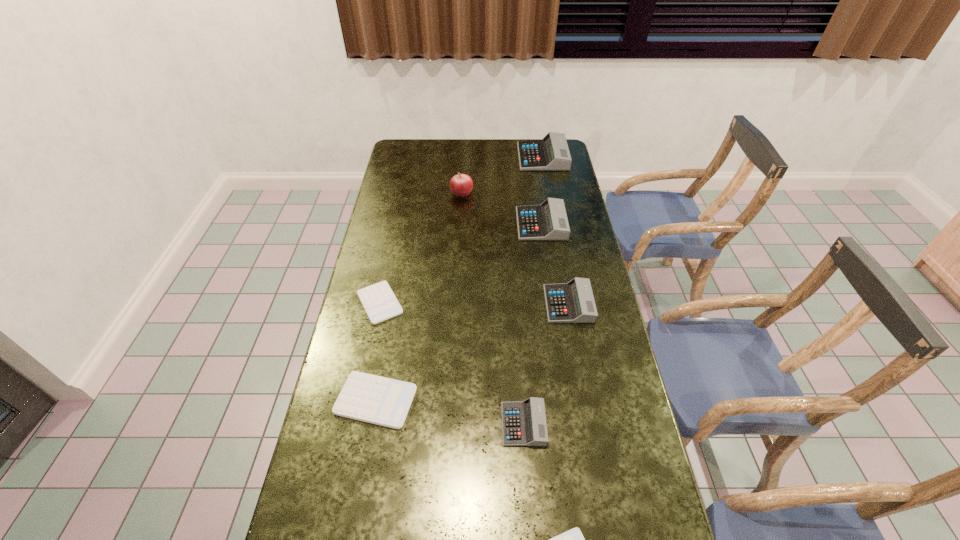
Find the location of `the second farthest white calculator`. the second farthest white calculator is located at coordinates (365, 397).

Where is `the third shortest object`? the third shortest object is located at coordinates (365, 397).

In order to click on the sixth tallest calculator in this screenshot , I will do pyautogui.click(x=378, y=300).

The height and width of the screenshot is (540, 960). What are the coordinates of `the second shortest object` in the screenshot? It's located at (378, 300).

Locate an element on the screen. The width and height of the screenshot is (960, 540). blank space located 0.250m on the left of the tallest object is located at coordinates (390, 192).

This screenshot has height=540, width=960. In order to click on free space located on the left of the farthest calculator in this screenshot , I will do `click(499, 157)`.

You are a GUI agent. You are given a task and a screenshot of the screen. Output one action in this format:
    pyautogui.click(x=<x>, y=<y>)
    Task: Click on the vacant space located on the back of the third farthest object
    This screenshot has height=540, width=960.
    Given the screenshot: What is the action you would take?
    pyautogui.click(x=538, y=200)

This screenshot has width=960, height=540. In order to click on vacant space situated on the left of the third farthest gray calculator in this screenshot , I will do `click(446, 304)`.

Image resolution: width=960 pixels, height=540 pixels. I want to click on vacant position located on the right of the smallest gray calculator, so point(572,424).

Where is `vacant space situated on the back of the second nearest white calculator`? The image size is (960, 540). vacant space situated on the back of the second nearest white calculator is located at coordinates (384, 355).